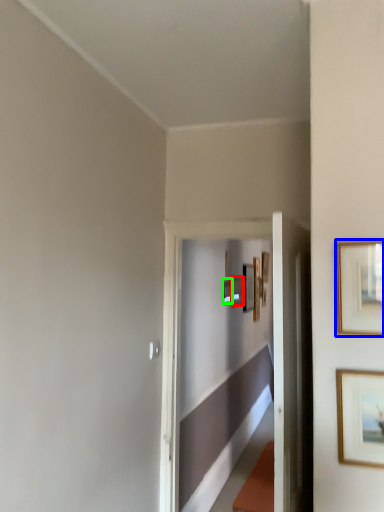
Question: Which object is the farthest from picture frame (highlighted by a red box)? Choose among these: picture frame (highlighted by a blue box) or picture frame (highlighted by a green box).

Choices:
 (A) picture frame
 (B) picture frame

Answer: (A)